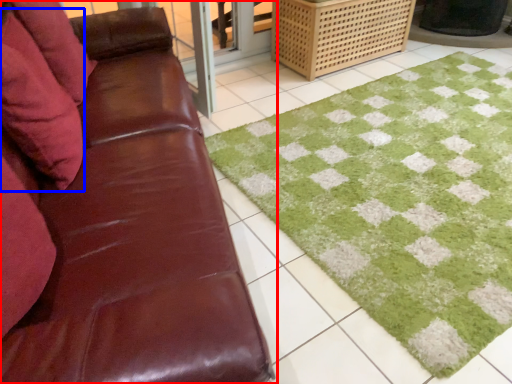
Question: Among these objects, which one is farthest to the camera, studio couch (highlighted by a red box) or pillow (highlighted by a blue box)?

Choices:
 (A) studio couch
 (B) pillow

Answer: (B)